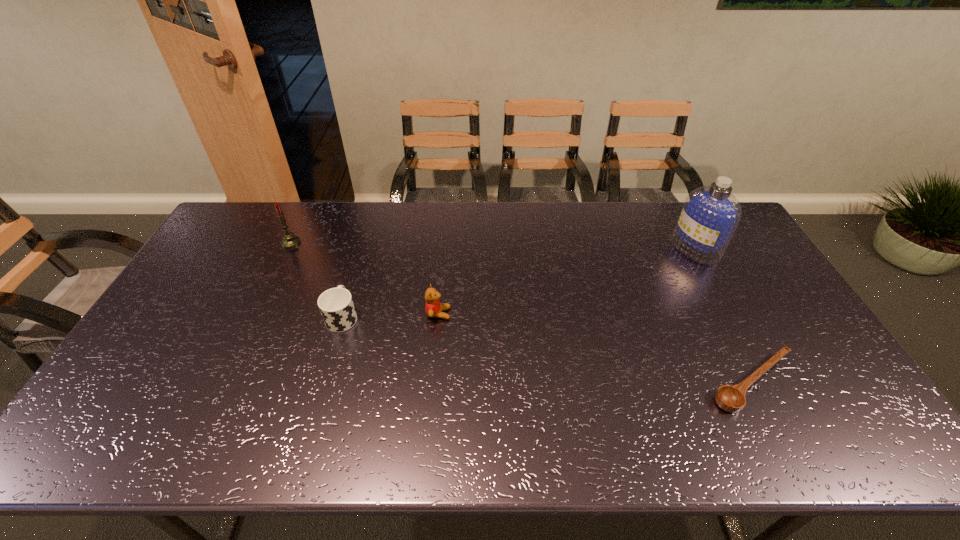
The image size is (960, 540). What are the coordinates of `vacant space that satisfies the following two spatial constraints: 1. on the side of the cup with the handle; 2. on the right side of the cleansing agent` in the screenshot? It's located at (363, 248).

In order to click on vacant region that satisfies the following two spatial constraints: 1. on the front side of the cleansing agent; 2. on the front-facing side of the teddy bear in this screenshot , I will do `click(731, 314)`.

Locate an element on the screen. The height and width of the screenshot is (540, 960). vacant space that satisfies the following two spatial constraints: 1. on the front-facing side of the third shortest object; 2. on the right side of the shortest object is located at coordinates (432, 382).

The image size is (960, 540). Find the location of `blank space that satisfies the following two spatial constraints: 1. on the front-facing side of the third object from left to right; 2. on the back side of the nearest object`. blank space that satisfies the following two spatial constraints: 1. on the front-facing side of the third object from left to right; 2. on the back side of the nearest object is located at coordinates (432, 382).